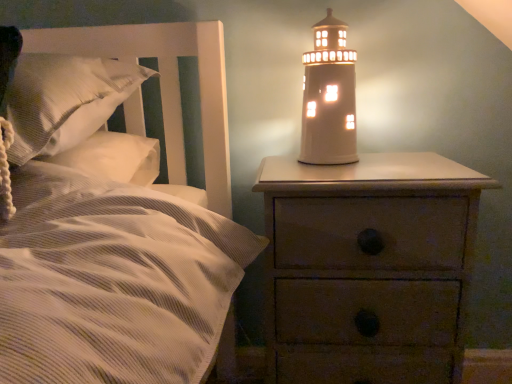
Question: From a real-world perspective, is white ceramic lighthouse at upper right physically above wooden nightstand at right?

Choices:
 (A) yes
 (B) no

Answer: (A)

Question: Is white ceramic lighthouse at upper right far away from wooden nightstand at right?

Choices:
 (A) yes
 (B) no

Answer: (B)

Question: Does white ceramic lighthouse at upper right come behind wooden nightstand at right?

Choices:
 (A) no
 (B) yes

Answer: (B)

Question: Is white ceramic lighthouse at upper right at the left side of wooden nightstand at right?

Choices:
 (A) yes
 (B) no

Answer: (A)

Question: Is white ceramic lighthouse at upper right next to wooden nightstand at right?

Choices:
 (A) no
 (B) yes

Answer: (A)

Question: Can you confirm if white ceramic lighthouse at upper right is taller than wooden nightstand at right?

Choices:
 (A) yes
 (B) no

Answer: (B)

Question: Considering the relative sizes of white ceramic lighthouse at upper right and white textured pillow at left in the image provided, is white ceramic lighthouse at upper right shorter than white textured pillow at left?

Choices:
 (A) yes
 (B) no

Answer: (B)

Question: From a real-world perspective, is white ceramic lighthouse at upper right on white textured pillow at left?

Choices:
 (A) yes
 (B) no

Answer: (A)

Question: From a real-world perspective, is white ceramic lighthouse at upper right under white textured pillow at left?

Choices:
 (A) yes
 (B) no

Answer: (B)

Question: Is white ceramic lighthouse at upper right facing away from white textured pillow at left?

Choices:
 (A) yes
 (B) no

Answer: (B)

Question: Is white ceramic lighthouse at upper right directly adjacent to white textured pillow at left?

Choices:
 (A) no
 (B) yes

Answer: (A)

Question: Would you consider white ceramic lighthouse at upper right to be distant from white textured pillow at left?

Choices:
 (A) no
 (B) yes

Answer: (A)

Question: From a real-world perspective, does white textured pillow at left sit lower than white ceramic lighthouse at upper right?

Choices:
 (A) no
 (B) yes

Answer: (B)